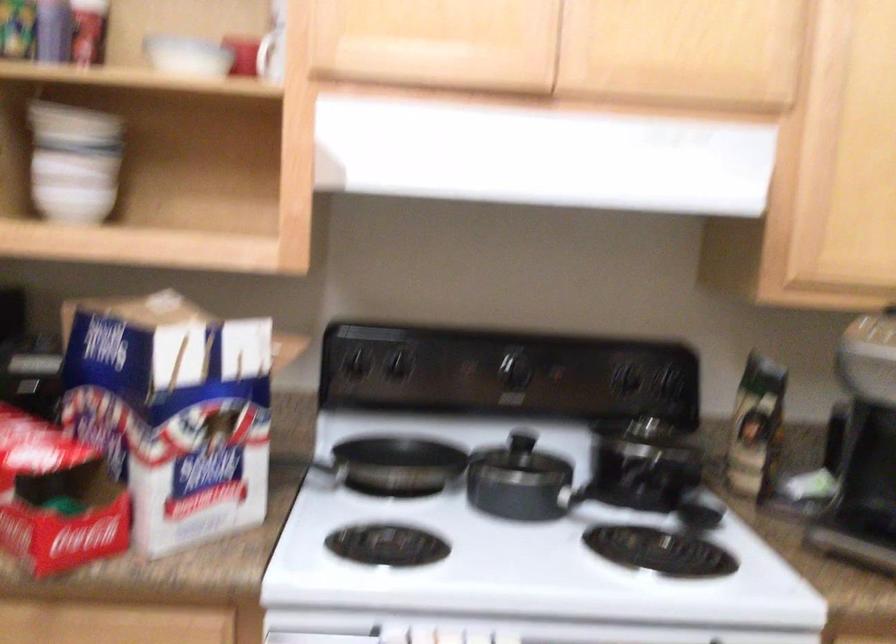
Find where to lift the pot lid handle. Please return your answer as a coordinate pair (x, y).

(521, 440)